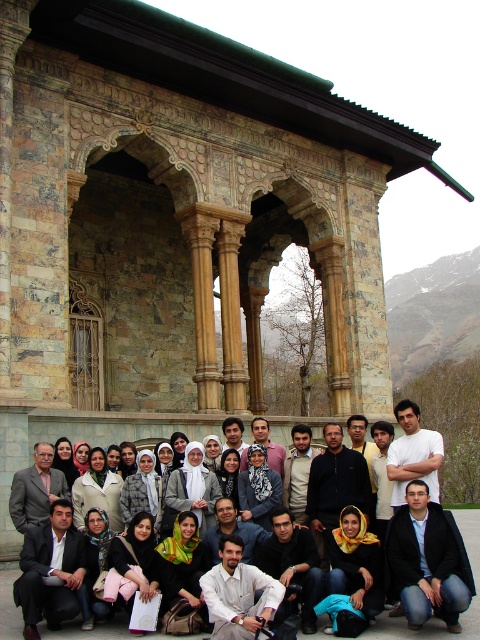
Is white cotton shirt at center further to the viewer compared to dark blue jeans at lower right?

No, white cotton shirt at center is closer to the viewer.

Between white cotton shirt at center and dark blue jeans at lower right, which one appears on the right side from the viewer's perspective?

From the viewer's perspective, white cotton shirt at center appears more on the right side.

Does point (17, 548) lie in front of point (419, 579)?

No, it is behind (419, 579).

In order to click on white cotton shirt at center in this screenshot , I will do tap(92, 426).